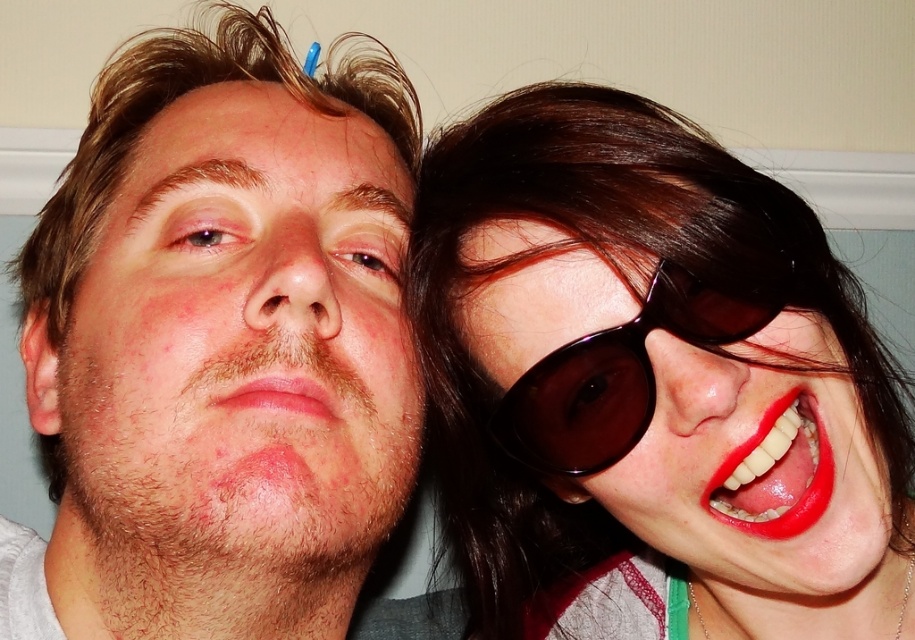
Based on the photo, which is above, smooth skin face at center or pink matte lips at center?

Positioned higher is smooth skin face at center.

In the scene shown: Who is positioned more to the left, smooth skin face at center or pink matte lips at center?

smooth skin face at center

Is point (378, 307) behind point (321, 406)?

Yes, it is behind point (321, 406).

Where is `smooth skin face at center`? This screenshot has height=640, width=915. smooth skin face at center is located at coordinates (235, 342).

Does point (83, 321) come in front of point (797, 512)?

No, (83, 321) is behind (797, 512).

Is point (188, 342) behind point (798, 492)?

Yes, it is.

Image resolution: width=915 pixels, height=640 pixels. Describe the element at coordinates (235, 342) in the screenshot. I see `smooth skin face at center` at that location.

I want to click on smooth skin face at center, so pos(235,342).

Who is more forward, (650, 365) or (307, 388)?

Positioned in front is point (650, 365).

Who is higher up, black shiny sunglasses at right or pink matte lips at center?

black shiny sunglasses at right is above.

Which is in front, point (518, 448) or point (298, 380)?

Point (298, 380)

The height and width of the screenshot is (640, 915). Identify the location of black shiny sunglasses at right. (620, 372).